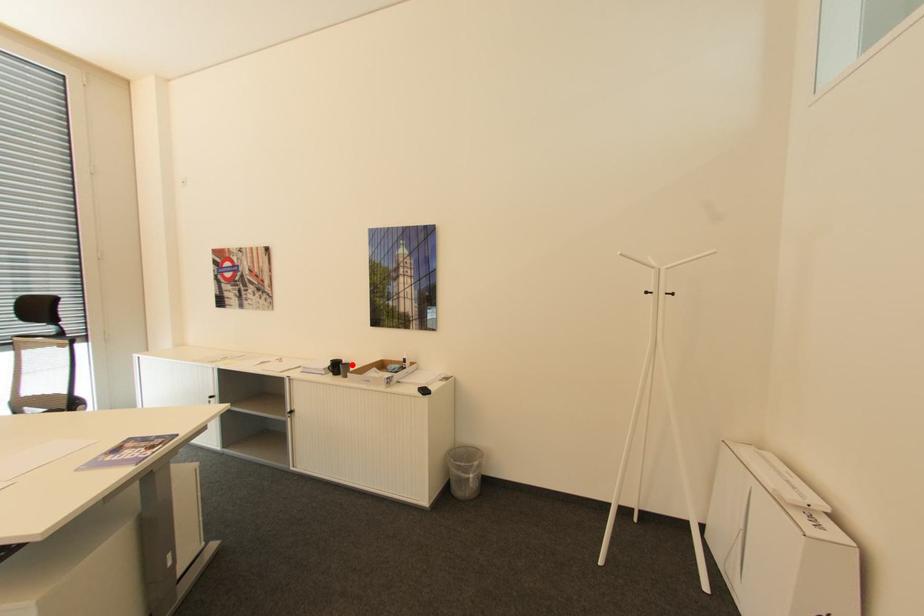
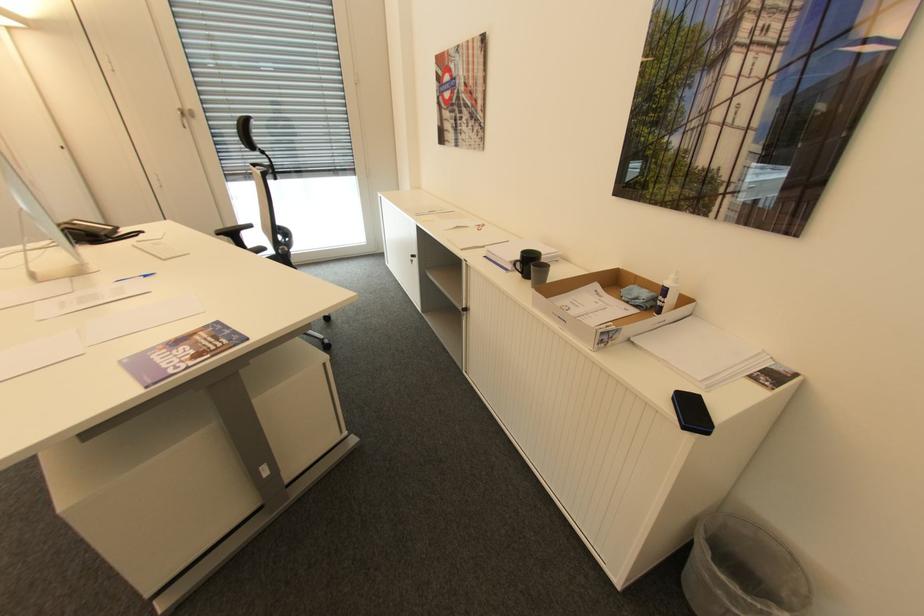
The point at the highlighted location is marked in the first image. Where is the corresponding point in the second image?

(550, 268)